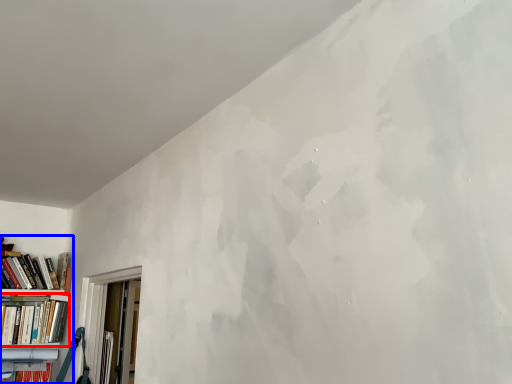
Question: Which object appears farthest to the camera in this image, book (highlighted by a red box) or bookcase (highlighted by a blue box)?

Choices:
 (A) book
 (B) bookcase

Answer: (A)